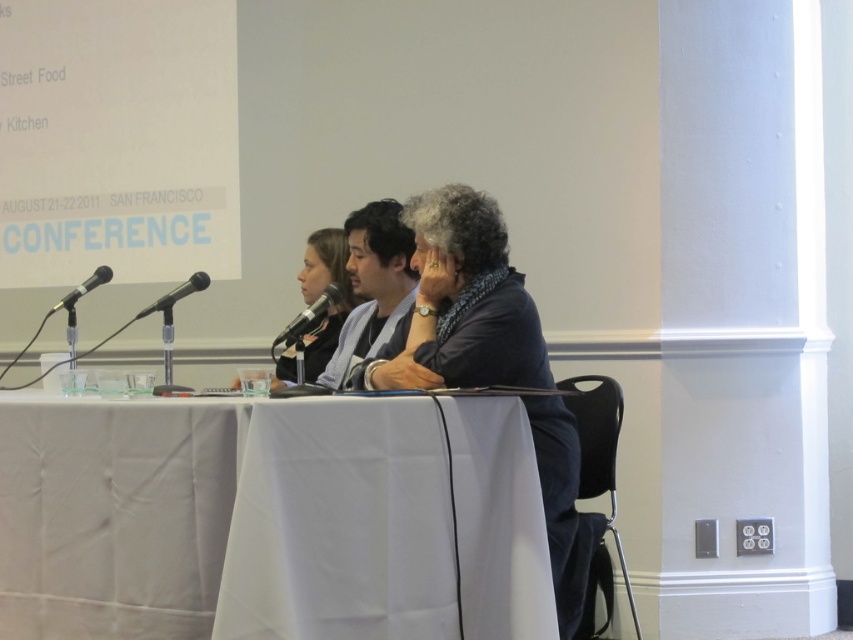
Is point (279, 378) positioned after point (57, 301)?

No, it is not.

Is point (328, 337) closer to viewer compared to point (94, 273)?

Yes, it is in front of point (94, 273).

The height and width of the screenshot is (640, 853). What do you see at coordinates (323, 289) in the screenshot?
I see `matte black jacket at center` at bounding box center [323, 289].

Image resolution: width=853 pixels, height=640 pixels. In order to click on matte black jacket at center in this screenshot , I will do `click(323, 289)`.

Between point (334, 296) and point (184, 289), which one is positioned in front?

Point (334, 296)

What do you see at coordinates (309, 316) in the screenshot?
I see `black matte microphone at center` at bounding box center [309, 316].

Where is `black matte microphone at center`? The height and width of the screenshot is (640, 853). black matte microphone at center is located at coordinates (309, 316).

Does matte black jacket at center have a lesser height compared to black matte microphone at center?

No, matte black jacket at center is not shorter than black matte microphone at center.

Is point (328, 317) less distant than point (340, 300)?

No, (328, 317) is further to viewer.

The image size is (853, 640). Identify the location of matte black jacket at center. (323, 289).